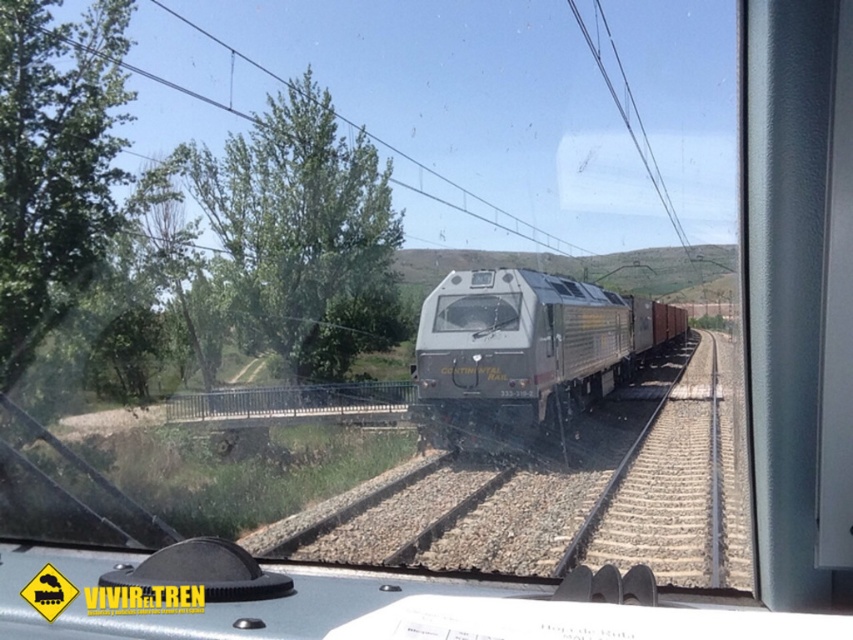
Question: Can you confirm if green leafy tree at upper left is positioned to the right of metallic wire at upper center?

Choices:
 (A) no
 (B) yes

Answer: (A)

Question: Among these objects, which one is nearest to the camera?

Choices:
 (A) green leafy tree at left
 (B) green leafy tree at upper left
 (C) metallic wire at upper center

Answer: (A)

Question: Which of these objects is positioned closest to the green leafy tree at upper left?

Choices:
 (A) metallic silver train at center
 (B) metallic wire at upper center
 (C) green leafy tree at left

Answer: (B)

Question: From the image, what is the correct spatial relationship of green leafy tree at left in relation to metallic silver train at center?

Choices:
 (A) left
 (B) right

Answer: (A)

Question: Estimate the real-world distances between objects in this image. Which object is farther from the green leafy tree at upper left?

Choices:
 (A) green leafy tree at left
 (B) metallic silver train at center
 (C) metallic wire at upper center

Answer: (A)

Question: Is green leafy tree at upper left below green leafy tree at left?

Choices:
 (A) yes
 (B) no

Answer: (B)